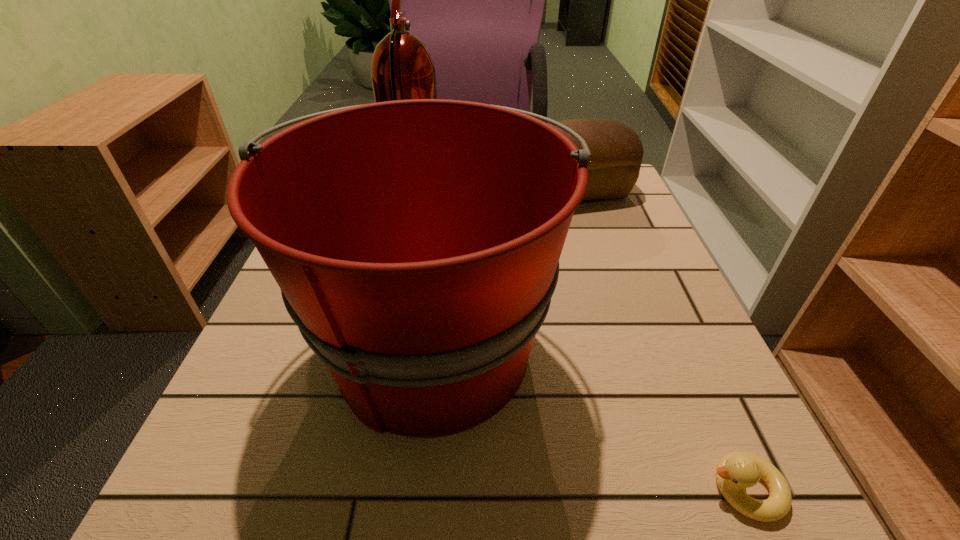
This screenshot has height=540, width=960. In order to click on object that is at the far right corner in this screenshot , I will do `click(616, 150)`.

Where is `object that is at the near right corner`? object that is at the near right corner is located at coordinates (736, 471).

At what (x,y) coordinates should I click in order to perform the action: click on vacant space at the right edge of the desktop. Please return your answer as a coordinate pair (x, y). This screenshot has height=540, width=960. Looking at the image, I should click on (711, 347).

The image size is (960, 540). In order to click on free point between the shortest object and the bread in this screenshot , I will do `click(658, 341)`.

Where is `free area in between the second tallest object and the duckling`? This screenshot has height=540, width=960. free area in between the second tallest object and the duckling is located at coordinates (589, 418).

This screenshot has width=960, height=540. I want to click on vacant point located between the third tallest object and the duckling, so click(658, 341).

Find the location of `unoccupied position between the fire extinguisher and the shortest object`. unoccupied position between the fire extinguisher and the shortest object is located at coordinates (580, 343).

Identify the location of vacant area between the third shortest object and the duckling. The height and width of the screenshot is (540, 960). pyautogui.click(x=589, y=418).

Select which object is the third closest to the third shortest object. Please provide its 2D coordinates. Your answer should be formatted as a tuple, i.e. [(x, y)], where the tuple contains the x and y coordinates of a point satisfying the conditions above.

[(616, 150)]

This screenshot has width=960, height=540. What are the coordinates of `object that is the closest to the bucket` in the screenshot? It's located at (736, 471).